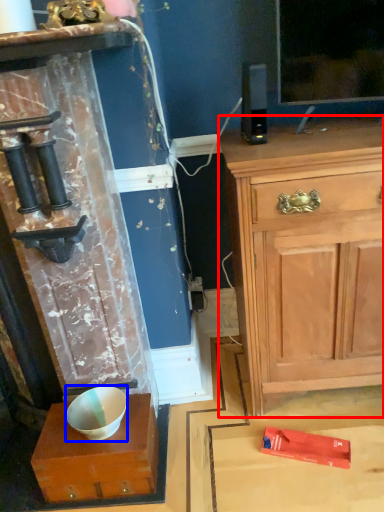
Question: Among these objects, which one is nearest to the camera, chest of drawers (highlighted by a red box) or bowl (highlighted by a blue box)?

Choices:
 (A) chest of drawers
 (B) bowl

Answer: (A)